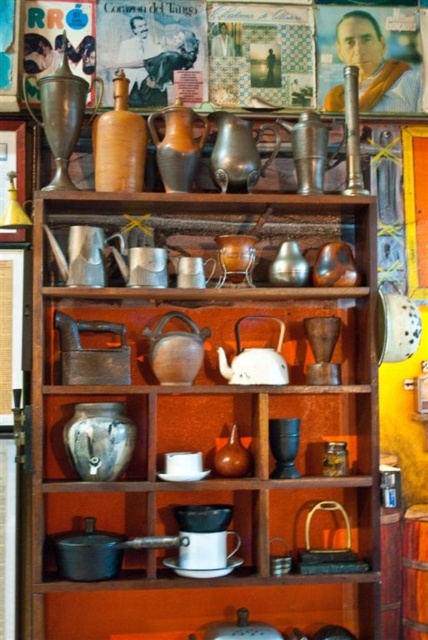
Does shiny silver teapot at center have a smaller size compared to matte brown jar at center?

Incorrect, shiny silver teapot at center is not smaller in size than matte brown jar at center.

Is shiny silver teapot at center to the left of matte brown jar at center from the viewer's perspective?

Yes, shiny silver teapot at center is to the left of matte brown jar at center.

Describe the element at coordinates (237, 152) in the screenshot. I see `shiny silver teapot at center` at that location.

Find the location of a particular element. The image size is (428, 640). shiny silver teapot at center is located at coordinates (237, 152).

Can you confirm if shiny silver teapot at center is positioned to the left of brushed metal tea pot at left?

In fact, shiny silver teapot at center is to the right of brushed metal tea pot at left.

Is point (211, 168) farther from viewer compared to point (97, 269)?

That is True.

What do you see at coordinates (237, 152) in the screenshot?
I see `shiny silver teapot at center` at bounding box center [237, 152].

Find the location of `shiny silver teapot at center`. shiny silver teapot at center is located at coordinates (237, 152).

Does brushed metal tea pot at left appear on the left side of white matte teapot at center?

Yes, brushed metal tea pot at left is to the left of white matte teapot at center.

Which is more to the right, brushed metal tea pot at left or white matte teapot at center?

From the viewer's perspective, white matte teapot at center appears more on the right side.

Who is more forward, (74, 228) or (228, 368)?

Point (74, 228) is in front.

In order to click on brushed metal tea pot at left in this screenshot , I will do `click(85, 256)`.